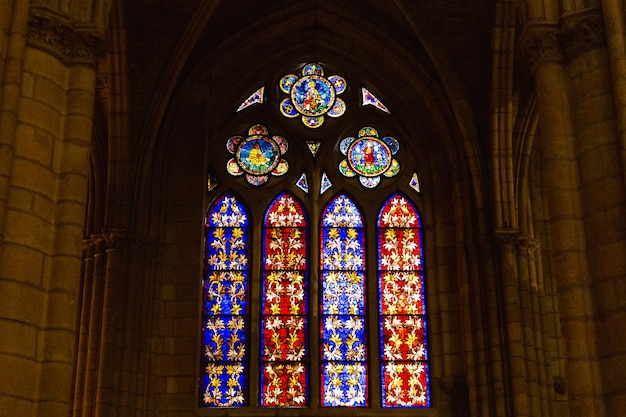
The image size is (626, 417). What are the coordinates of `flower shaped windows` in the screenshot? It's located at (312, 84), (362, 152), (257, 161).